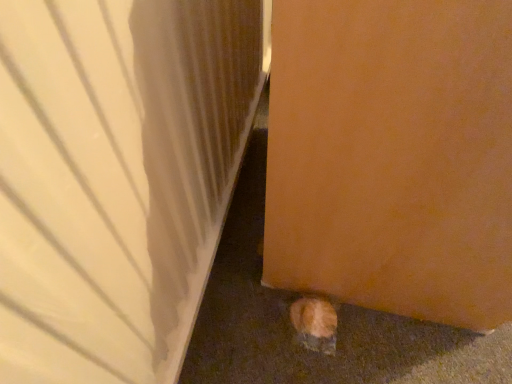
Question: Which is correct: orange fur cat at lower right is inside matte wood door at lower right, acting as the 2th door starting from the right, or outside of it?

Choices:
 (A) inside
 (B) outside

Answer: (B)

Question: Considering their positions, is orange fur cat at lower right located in front of or behind matte wood door at lower right, acting as the 2th door starting from the right?

Choices:
 (A) behind
 (B) front

Answer: (A)

Question: Estimate the real-world distances between objects in this image. Which object is farther from the matte wood door at lower right, acting as the 2th door starting from the right?

Choices:
 (A) orange matte door at lower right, the 2th door from the left
 (B) orange fur cat at lower right

Answer: (B)

Question: Estimate the real-world distances between objects in this image. Which object is closer to the orange matte door at lower right, the 2th door from the left?

Choices:
 (A) orange fur cat at lower right
 (B) matte wood door at lower right, acting as the 2th door starting from the right

Answer: (B)